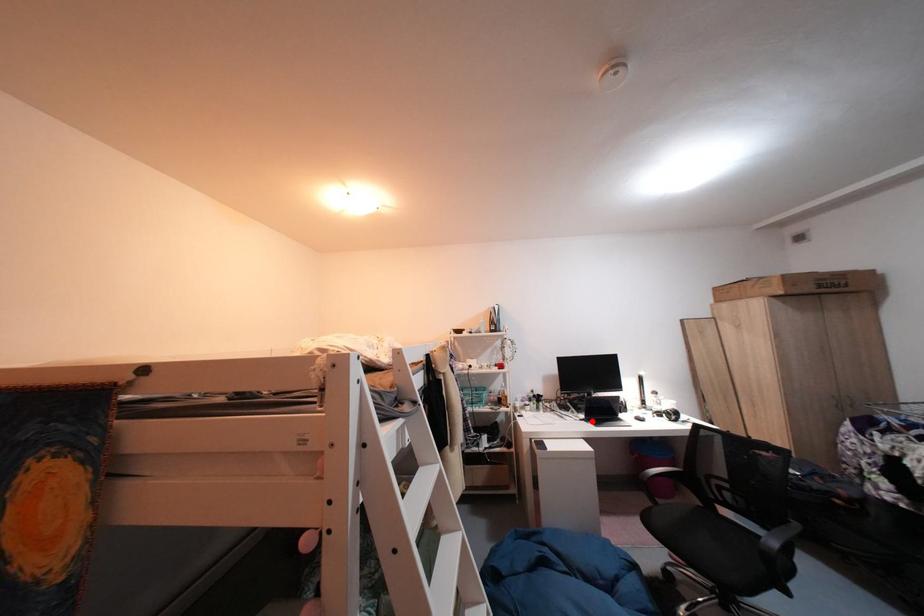
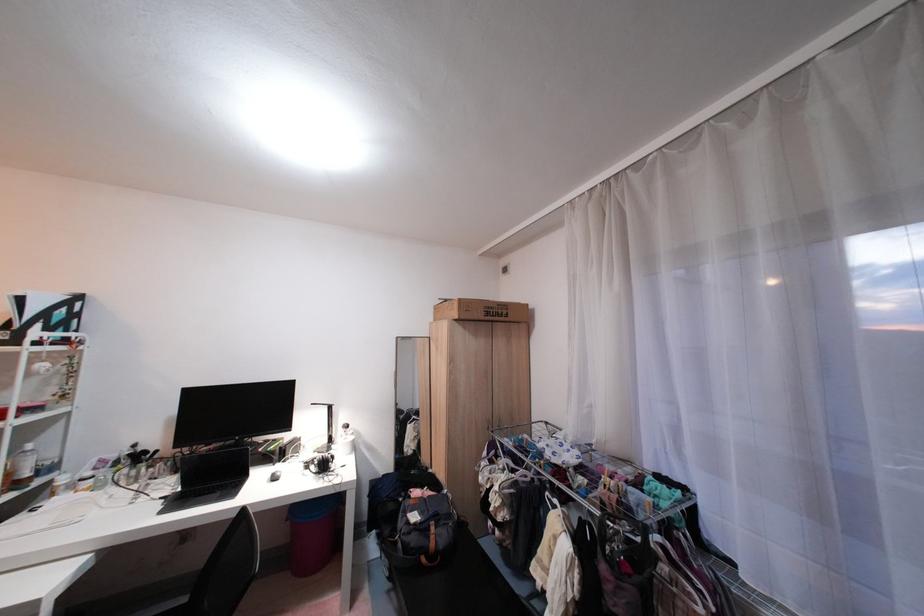
The point at the highlighted location is marked in the first image. Where is the corresponding point in the second image?

(172, 500)